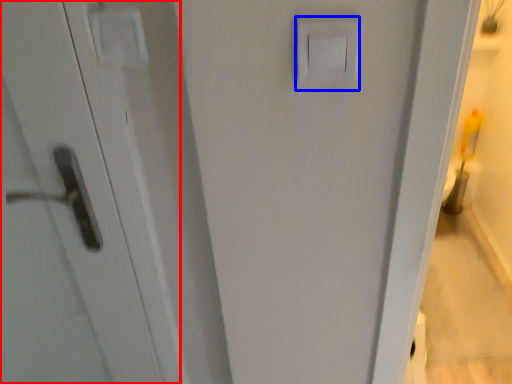
Question: Which of the following is the closest to the observer, screen door (highlighted by a red box) or light switch (highlighted by a blue box)?

Choices:
 (A) screen door
 (B) light switch

Answer: (B)